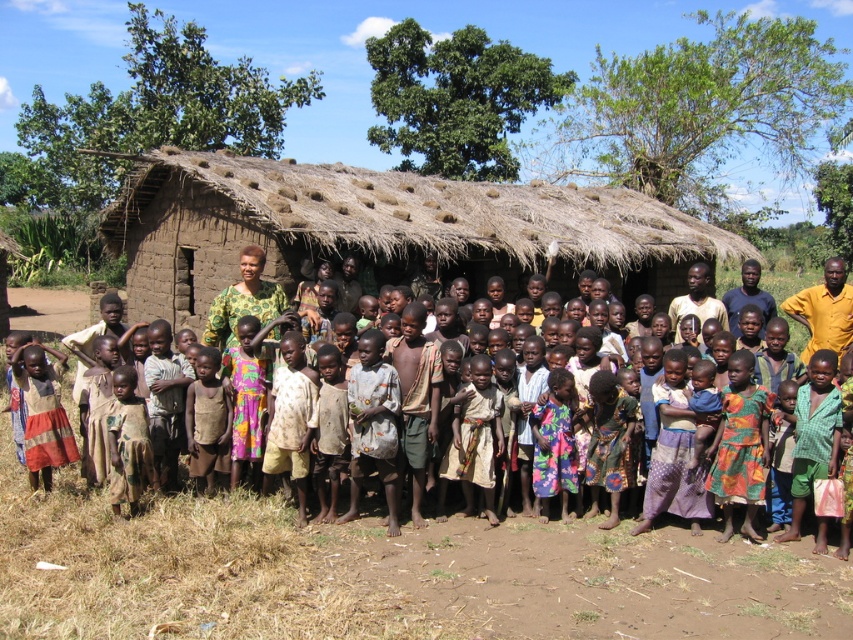
Between brown thatch hut at center and printed fabric dress at center, which one has more height?

Standing taller between the two is brown thatch hut at center.

Who is more forward, (180,300) or (238,508)?

Point (238,508) is more forward.

Locate an element on the screen. brown thatch hut at center is located at coordinates (384, 228).